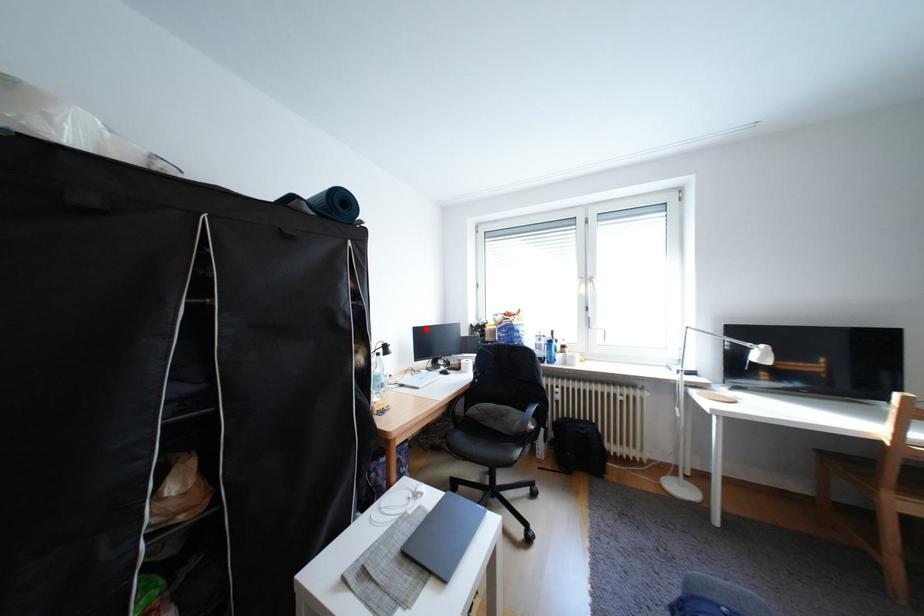
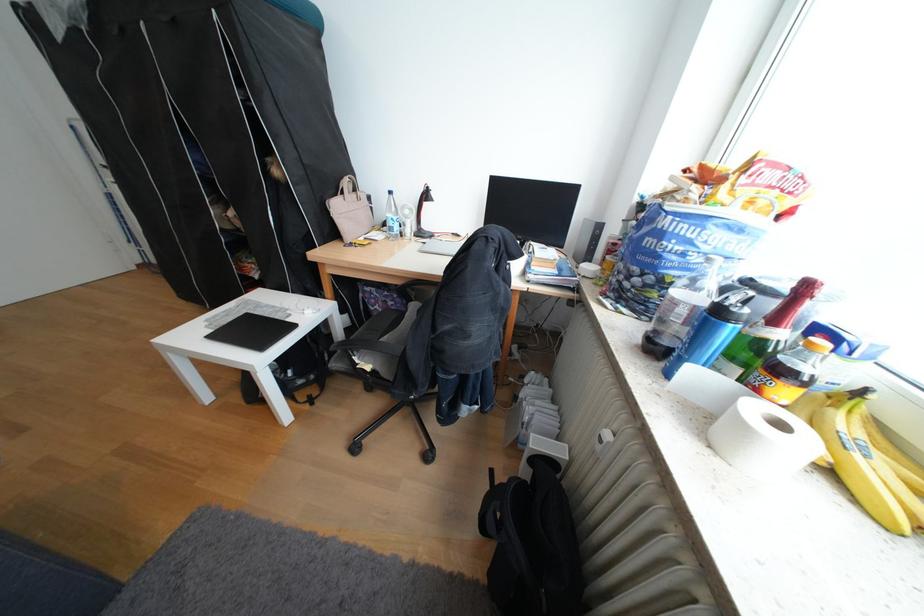
Question: A red point is marked in image1. In image2, is the corresponding 3D point closer to the camera or farther? Reply with the corresponding letter.

Choices:
 (A) The corresponding 3D point is closer.
 (B) The corresponding 3D point is farther.

Answer: (A)